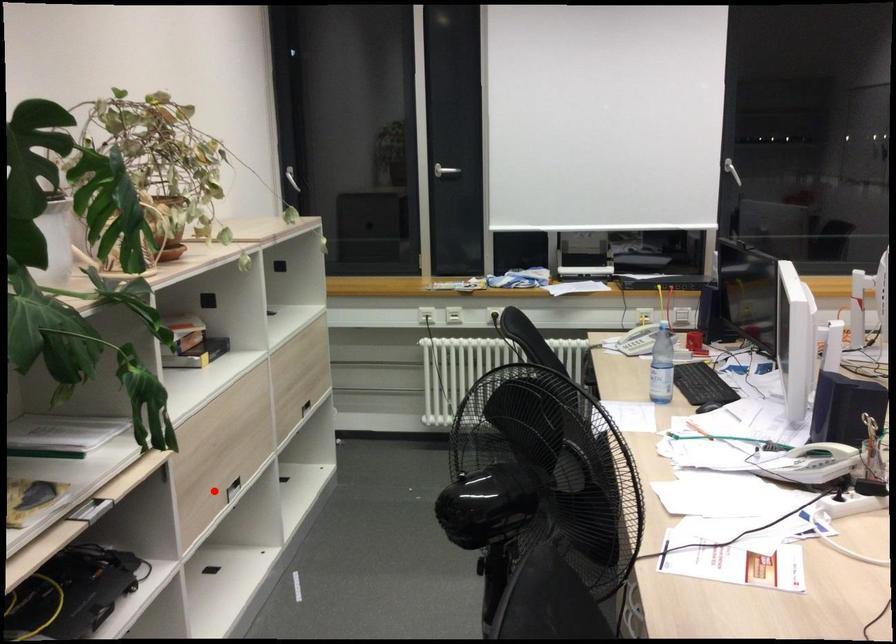
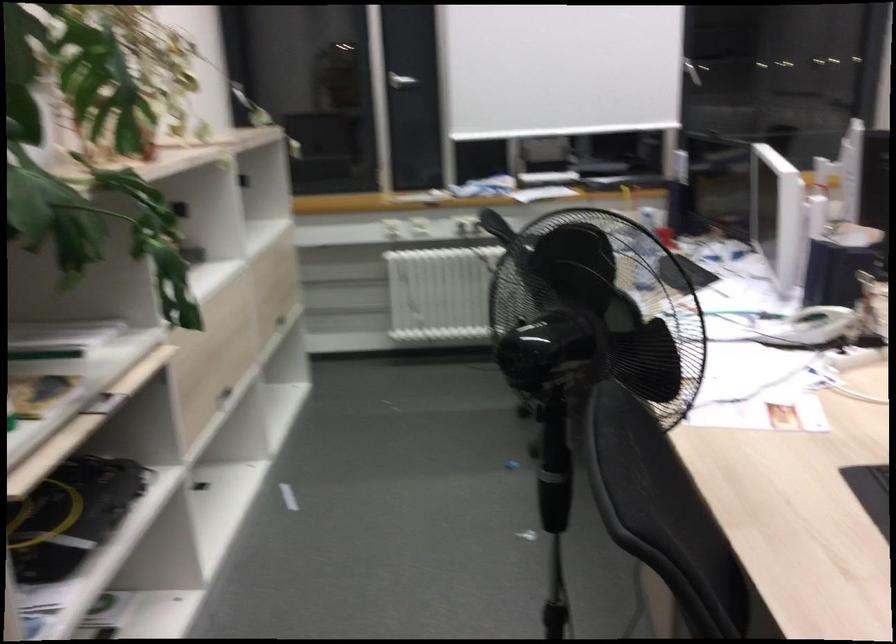
The point at the highlighted location is marked in the first image. Where is the corresponding point in the second image?

(211, 395)